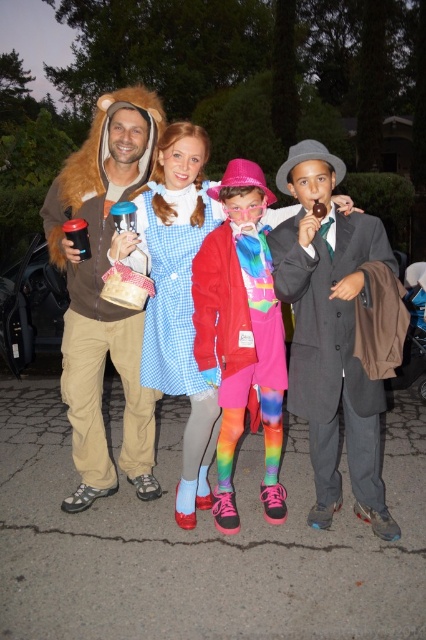
Which is more to the left, fuzzy brown coat at left or matte gray suit at center?

Positioned to the left is fuzzy brown coat at left.

Who is taller, fuzzy brown coat at left or matte gray suit at center?

matte gray suit at center is taller.

Between point (126, 440) and point (339, 344), which one is positioned behind?

The point (126, 440) is behind.

Locate an element on the screen. The width and height of the screenshot is (426, 640). fuzzy brown coat at left is located at coordinates (103, 298).

Does matte blue dress at center have a greater width compared to rainbow tights at center?

Yes, matte blue dress at center is wider than rainbow tights at center.

Is point (157, 132) positioned after point (196, 294)?

Yes, it is.

I want to click on matte blue dress at center, so click(x=114, y=193).

Can you confirm if fuzzy brown coat at left is positioned to the right of rainbow tights at center?

In fact, fuzzy brown coat at left is to the left of rainbow tights at center.

Is point (89, 195) in front of point (261, 266)?

No, (89, 195) is behind (261, 266).

In order to click on fuzzy brown coat at left in this screenshot , I will do [x=103, y=298].

Find the location of a particular element. The image size is (426, 640). fuzzy brown coat at left is located at coordinates (103, 298).